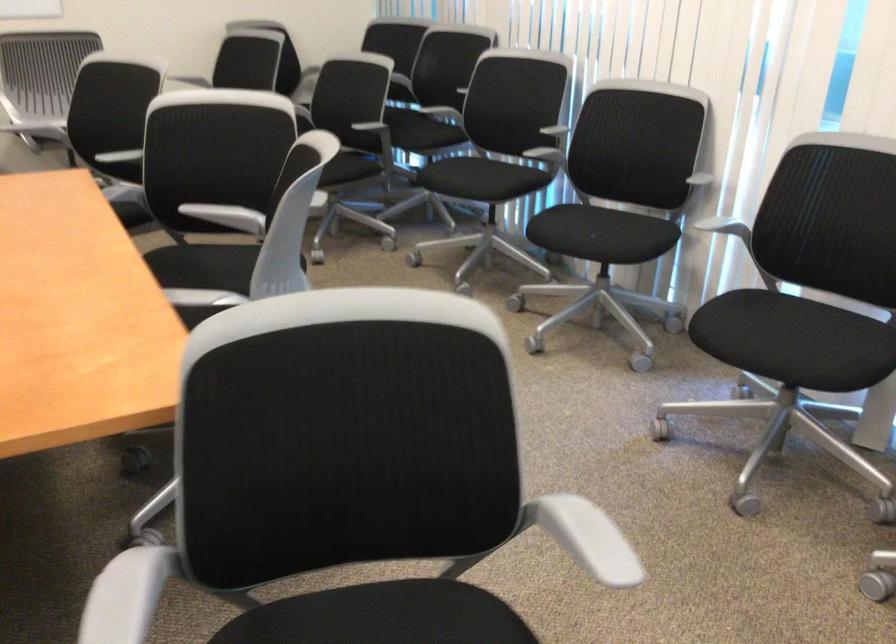
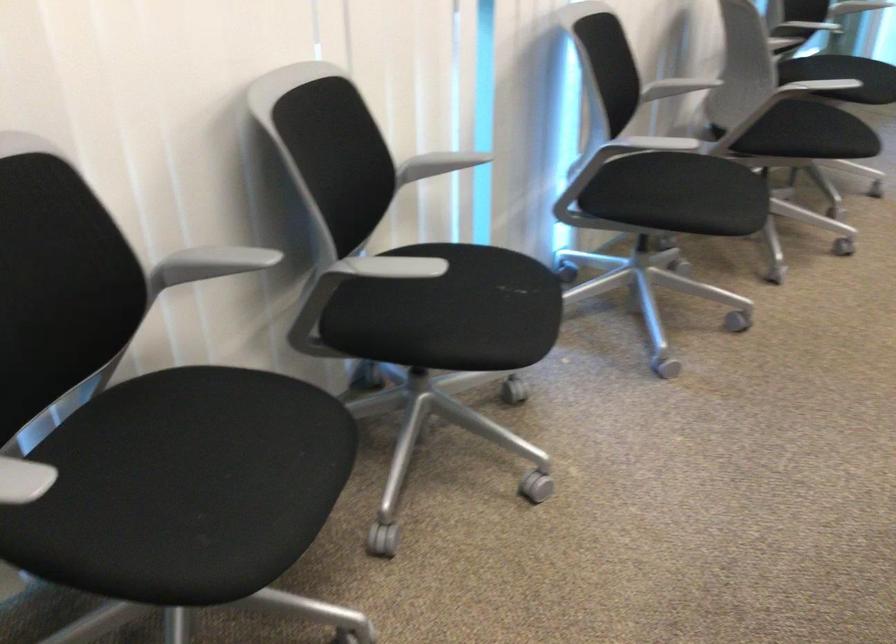
The point at (476, 174) is marked in the first image. Where is the corresponding point in the second image?

(226, 456)